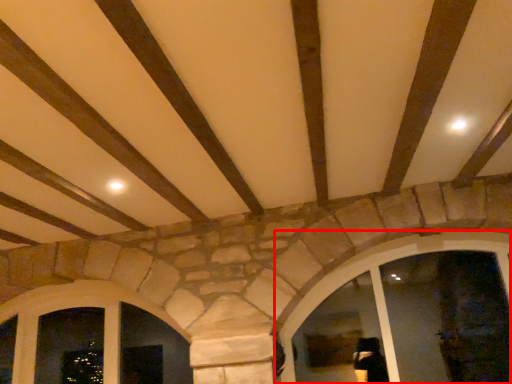
Question: In this image, where is window (annotated by the red box) located relative to window?

Choices:
 (A) left
 (B) right

Answer: (B)